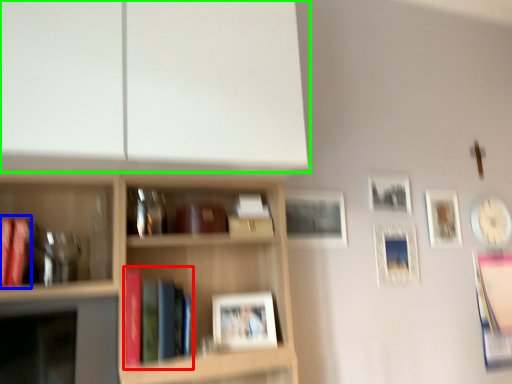
Question: Estimate the real-world distances between objects in this image. Which object is closer to book (highlighted by a red box), book (highlighted by a blue box) or shelf (highlighted by a green box)?

Choices:
 (A) book
 (B) shelf

Answer: (A)